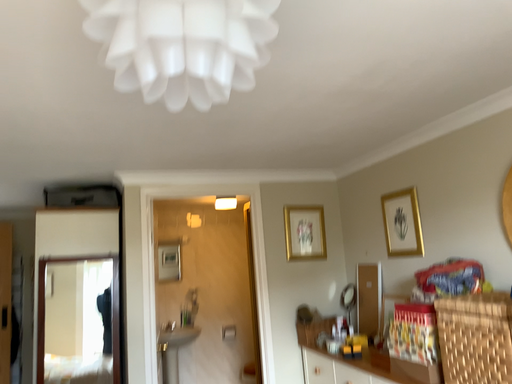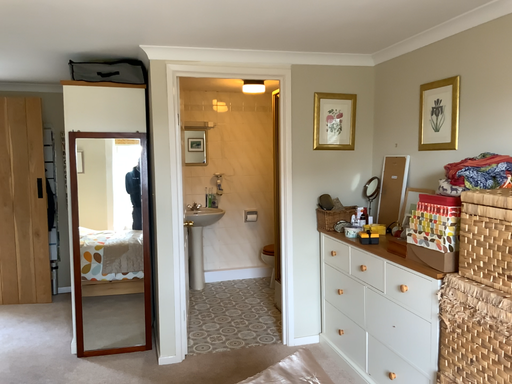
Question: How did the camera likely rotate when shooting the video?

Choices:
 (A) rotated downward
 (B) rotated upward

Answer: (A)